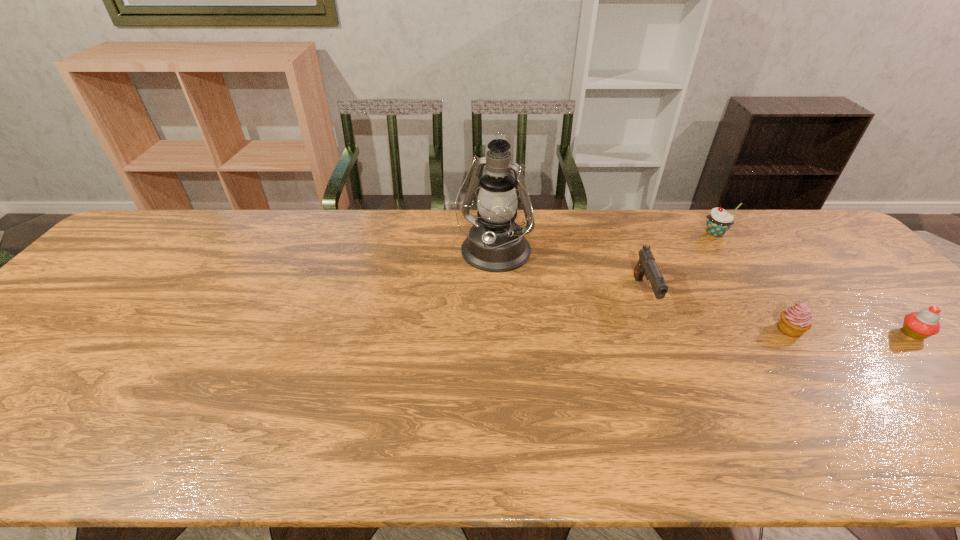
Find the location of a particular element. Image resolution: width=960 pixels, height=540 pixels. the tallest object is located at coordinates (496, 243).

You are a GUI agent. You are given a task and a screenshot of the screen. Output one action in this format:
    pyautogui.click(x=<x>, y=<y>)
    Task: Click on the leftmost object
    
    Given the screenshot: What is the action you would take?
    pyautogui.click(x=496, y=243)

I want to click on the tallest cupcake, so click(719, 221).

Where is `gun`? gun is located at coordinates (646, 265).

Locate an element on the screen. The height and width of the screenshot is (540, 960). the rightmost object is located at coordinates coord(920,325).

Where is `free space located 0.370m on the left of the oil lamp`? This screenshot has height=540, width=960. free space located 0.370m on the left of the oil lamp is located at coordinates (335, 254).

Identify the location of free space located 0.280m on the right of the tallest cupcake. (814, 233).

Where is `vacant space located 0.220m in the direction the gun is aimed`? This screenshot has width=960, height=540. vacant space located 0.220m in the direction the gun is aimed is located at coordinates (684, 390).

The height and width of the screenshot is (540, 960). I want to click on blank area located on the back of the rightmost object, so click(x=840, y=260).

The width and height of the screenshot is (960, 540). Identify the location of oil lamp at the far edge. (496, 243).